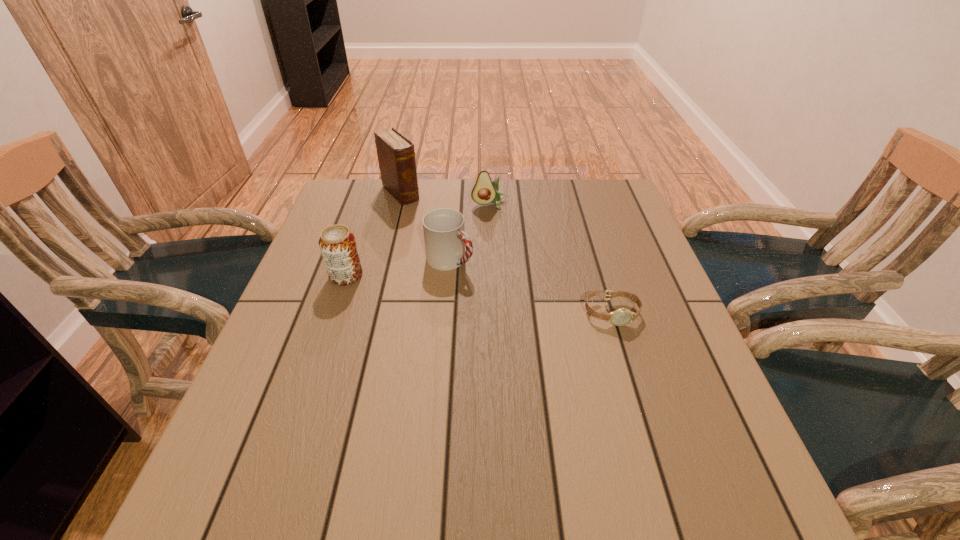
The image size is (960, 540). What are the coordinates of `beer can` in the screenshot? It's located at (337, 243).

What are the coordinates of `the rightmost object` in the screenshot? It's located at (620, 317).

This screenshot has width=960, height=540. I want to click on the nearest object, so click(x=620, y=317).

What are the coordinates of `the tallest object` in the screenshot? It's located at (396, 156).

Find the location of `cup`. cup is located at coordinates (445, 239).

Find the location of `avocado`. avocado is located at coordinates (484, 191).

At what (x,y) coordinates should I click in order to perform the action: click on vacant space located 0.110m on the right of the beer can. Please return your answer as a coordinate pair (x, y). This screenshot has width=960, height=540. Looking at the image, I should click on (407, 276).

Where is `free space located on the face of the rightmost object`? The height and width of the screenshot is (540, 960). free space located on the face of the rightmost object is located at coordinates (635, 390).

Locate an element on the screen. The image size is (960, 540). free region located on the spine side of the diary is located at coordinates (475, 266).

The image size is (960, 540). I want to click on vacant space situated 0.140m on the spine side of the diary, so click(x=433, y=226).